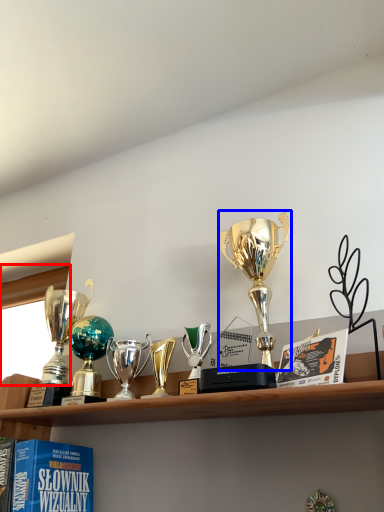
Question: Which object is further to the camera taking this photo, window screen (highlighted by a red box) or trophy (highlighted by a blue box)?

Choices:
 (A) window screen
 (B) trophy

Answer: (A)